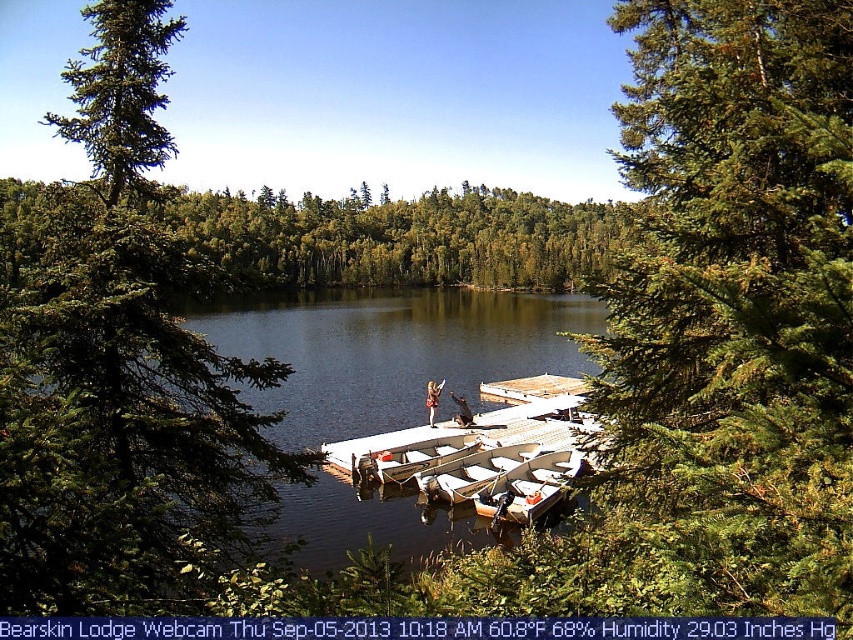
Question: Which point is closer to the camera?

Choices:
 (A) (521, 444)
 (B) (434, 198)

Answer: (A)

Question: Is wooden boat at lower right smaller than light brown wooden paddle at center?

Choices:
 (A) yes
 (B) no

Answer: (A)

Question: Which point is closer to the camera?

Choices:
 (A) (65, 209)
 (B) (194, 192)
 (C) (436, 394)

Answer: (A)

Question: Can you confirm if wooden boat at lower right is positioned to the left of wooden dock at center?

Choices:
 (A) no
 (B) yes

Answer: (B)

Question: Which point appears closest to the camera in this image?

Choices:
 (A) (479, 502)
 (B) (457, 419)
 (C) (693, 392)
 (D) (213, 236)

Answer: (C)

Question: Is green needle-like leaves at upper right wider than light brown wooden paddle at center?

Choices:
 (A) no
 (B) yes

Answer: (B)